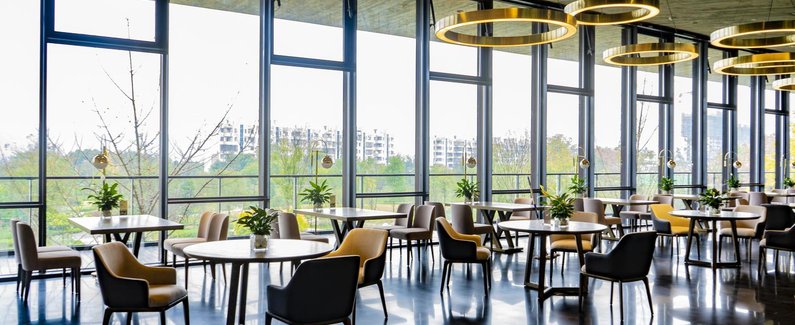
Find the location of `table lighting`. table lighting is located at coordinates (97, 162), (326, 162), (468, 160), (580, 165), (668, 164), (737, 163), (790, 164).